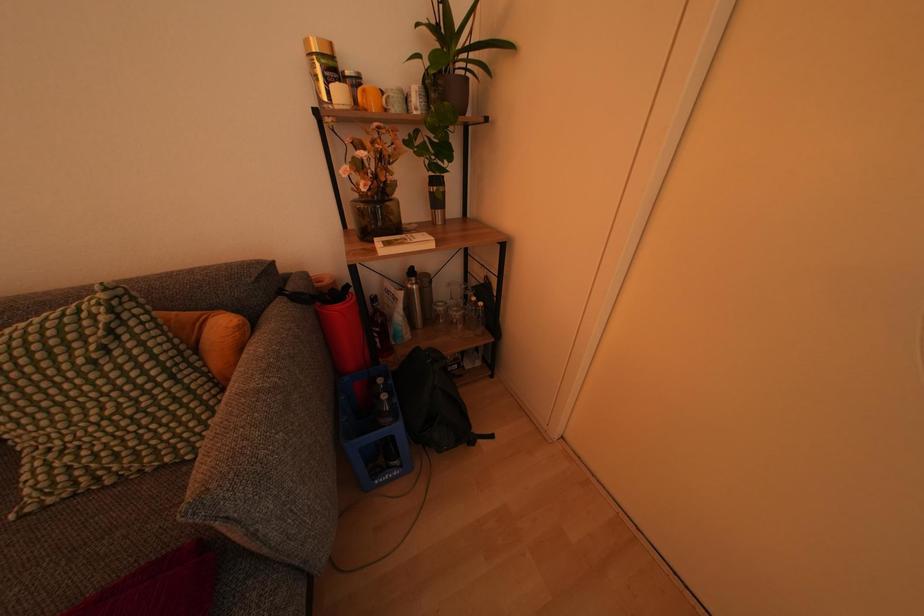
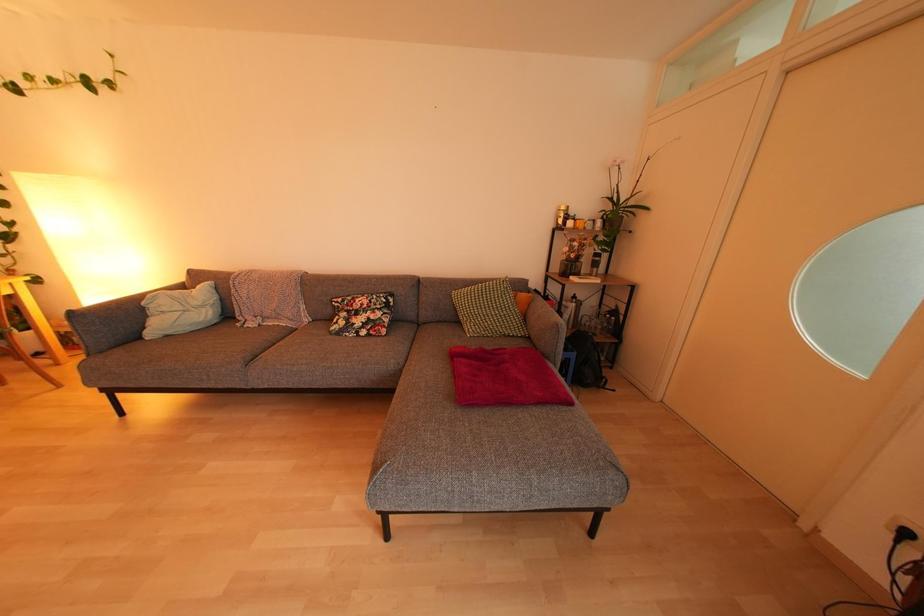
What movement of the cameraman would produce the second image?

The cameraman walked toward left, backward.